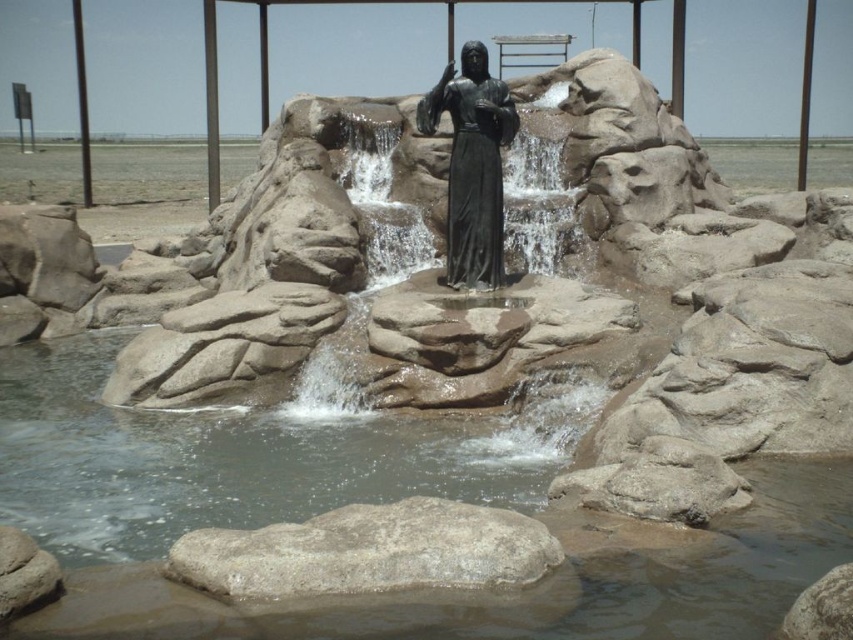
Is gray rough rock at center thinner than smooth stone waterfall at center?

Yes, gray rough rock at center is thinner than smooth stone waterfall at center.

Who is more distant from viewer, (231, 577) or (360, 376)?

Point (360, 376)

Locate an element on the screen. This screenshot has height=640, width=853. gray rough rock at center is located at coordinates (368, 552).

Is gray rough rock at center thinner than bronze statue at center?

Yes, gray rough rock at center is thinner than bronze statue at center.

Between point (419, 556) and point (421, 132), which one is positioned in front?

Point (419, 556) is more forward.

Is point (230, 589) behind point (456, 83)?

No.

The height and width of the screenshot is (640, 853). I want to click on gray rough rock at center, so click(x=368, y=552).

Between smooth stone waterfall at center and bronze statue at center, which one is positioned higher?

Positioned higher is bronze statue at center.

Is smooth stone waterfall at center to the left of bronze statue at center from the viewer's perspective?

Yes, smooth stone waterfall at center is to the left of bronze statue at center.

Is point (398, 115) farther from viewer compared to point (485, 136)?

Yes, it is behind point (485, 136).

Where is `smooth stone waterfall at center`? This screenshot has height=640, width=853. smooth stone waterfall at center is located at coordinates (364, 250).